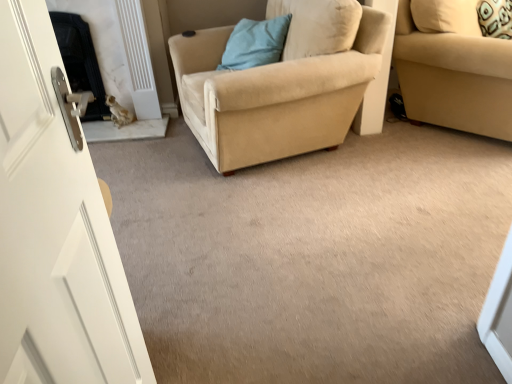
Question: Is black marble fireplace at left bigger or smaller than beige suede armchair at center?

Choices:
 (A) big
 (B) small

Answer: (B)

Question: Considering the relative positions of black marble fireplace at left and beige suede armchair at center in the image provided, is black marble fireplace at left to the left or to the right of beige suede armchair at center?

Choices:
 (A) left
 (B) right

Answer: (A)

Question: Estimate the real-world distances between objects in this image. Which object is closer to the beige fabric studio couch at right?

Choices:
 (A) beige suede armchair at center
 (B) blue fabric pillow at upper center
 (C) black marble fireplace at left

Answer: (A)

Question: Considering the real-world distances, which object is closest to the blue fabric pillow at upper center?

Choices:
 (A) beige fabric studio couch at right
 (B) black marble fireplace at left
 (C) beige suede armchair at center

Answer: (C)